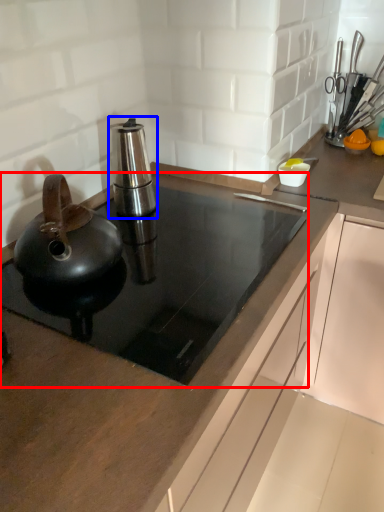
Question: Which object appears closest to the camera in this image, gas stove (highlighted by a red box) or kitchen appliance (highlighted by a blue box)?

Choices:
 (A) gas stove
 (B) kitchen appliance

Answer: (A)